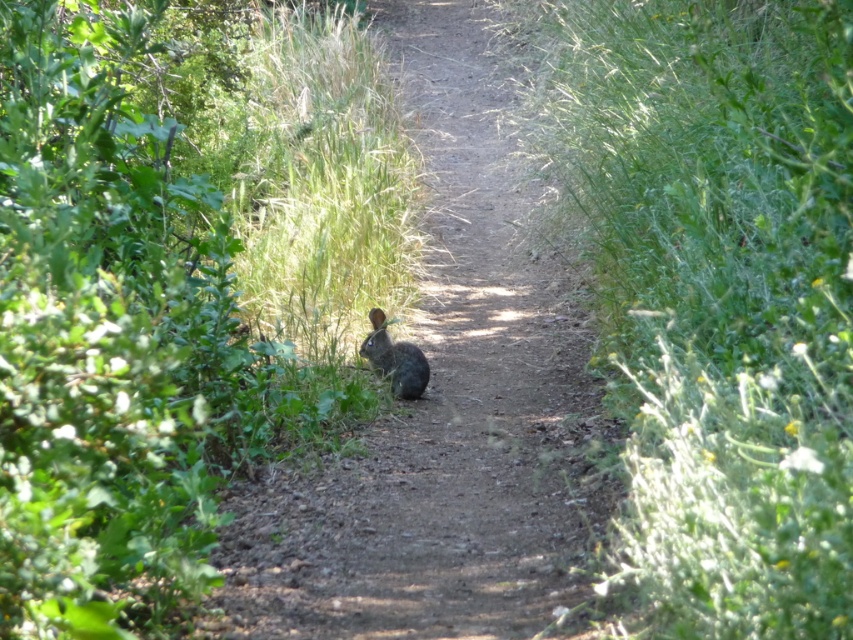
Between green leafy bush at center and brown fur rabbit at center, which one has less height?

With less height is green leafy bush at center.

Is point (299, 26) positioned after point (436, 442)?

Yes, it is behind point (436, 442).

You are a GUI agent. You are given a task and a screenshot of the screen. Output one action in this format:
    pyautogui.click(x=<x>, y=<y>)
    Task: Click on the green leafy bush at center
    The image size is (853, 640).
    Given the screenshot: What is the action you would take?
    pyautogui.click(x=177, y=284)

Can you confirm if brown fur rabbit at center is wider than fuzzy brown rabbit at center?

Yes.

Is point (480, 17) farther from viewer compared to point (412, 358)?

Yes, point (480, 17) is farther from viewer.

The image size is (853, 640). I want to click on brown fur rabbit at center, so click(442, 410).

Is point (83, 364) closer to viewer compared to point (378, 362)?

Yes, it is in front of point (378, 362).

Is green leafy bush at center thinner than fuzzy brown rabbit at center?

Correct, green leafy bush at center's width is less than fuzzy brown rabbit at center's.

Is point (219, 515) closer to viewer compared to point (372, 316)?

Yes, point (219, 515) is in front of point (372, 316).

Locate an element on the screen. Image resolution: width=853 pixels, height=640 pixels. green leafy bush at center is located at coordinates (177, 284).